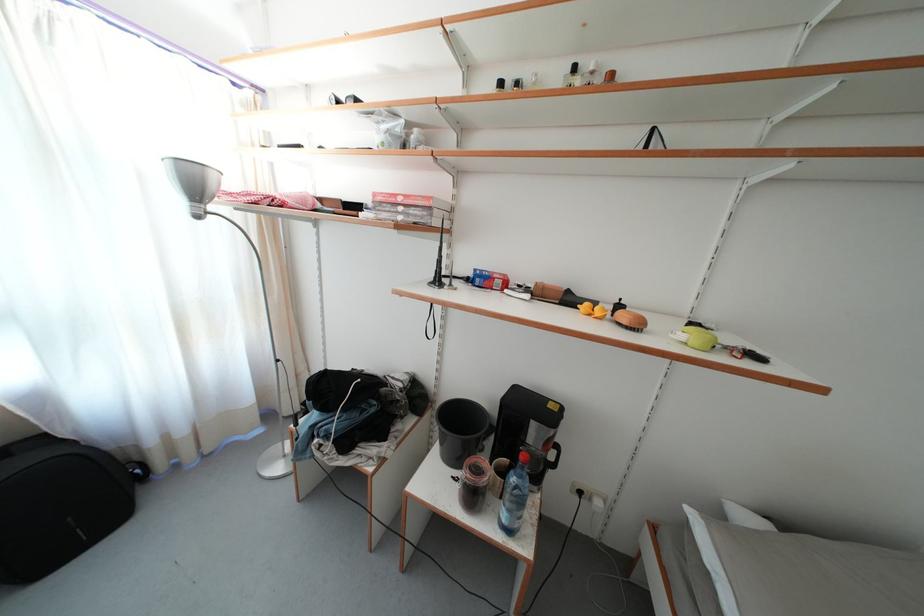
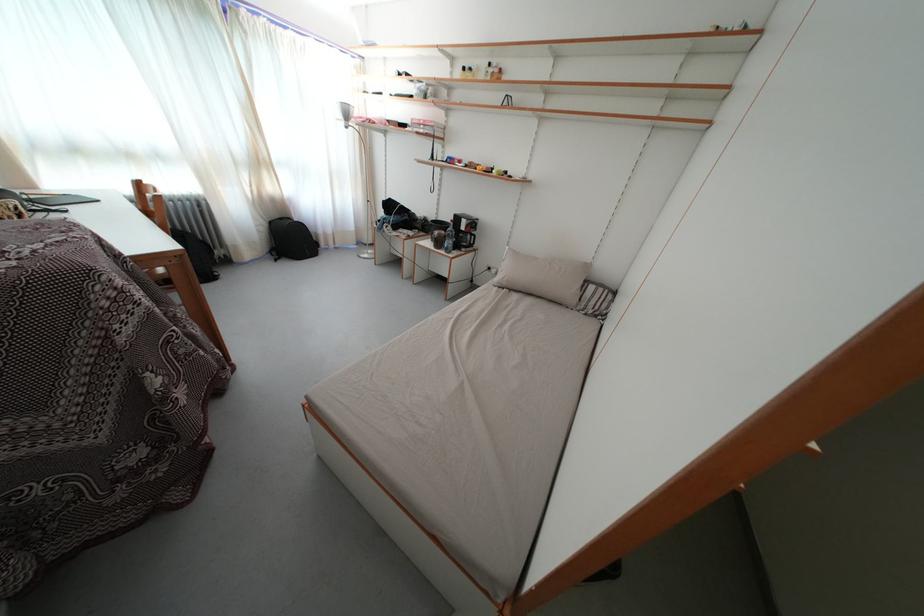
The point at (603, 509) is marked in the first image. Where is the corresponding point in the second image?

(500, 276)